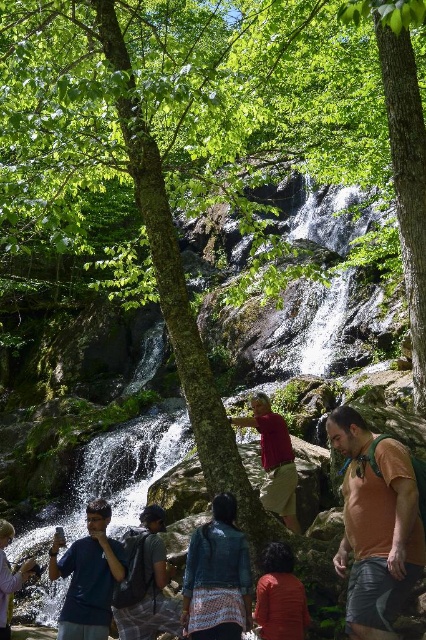
Can you confirm if blue textured jacket at center is smaller than matte orange shirt at lower center?

A: Actually, blue textured jacket at center might be larger than matte orange shirt at lower center.

Between blue textured jacket at center and matte orange shirt at lower center, which one appears on the left side from the viewer's perspective?

blue textured jacket at center is more to the left.

Is point (239, 589) behind point (276, 604)?

Yes, point (239, 589) is behind point (276, 604).

You are a GUI agent. You are given a task and a screenshot of the screen. Output one action in this format:
    pyautogui.click(x=<x>, y=<y>)
    Task: Click on the blue textured jacket at center
    The height and width of the screenshot is (640, 426).
    Given the screenshot: What is the action you would take?
    pyautogui.click(x=218, y=577)

This screenshot has width=426, height=640. What are the coordinates of `orange t-shirt at center` in the screenshot? It's located at (376, 525).

Which is more to the right, orange t-shirt at center or blue textured jacket at center?

Positioned to the right is orange t-shirt at center.

Between point (377, 602) and point (209, 572), which one is positioned in front?

Point (377, 602) is in front.

The image size is (426, 640). I want to click on orange t-shirt at center, so click(x=376, y=525).

Is point (83, 628) positioned after point (273, 467)?

No, it is not.

Is dark blue t-shirt at lower left to the left of matte red shirt at center from the viewer's perspective?

Correct, you'll find dark blue t-shirt at lower left to the left of matte red shirt at center.

Is point (89, 636) positioned behind point (270, 456)?

No, it is in front of (270, 456).

You are a GUI agent. You are given a task and a screenshot of the screen. Output one action in this format:
    pyautogui.click(x=<x>, y=<y>)
    Task: Click on the dark blue t-shirt at lower left
    This screenshot has height=640, width=426.
    Given the screenshot: What is the action you would take?
    pyautogui.click(x=88, y=577)